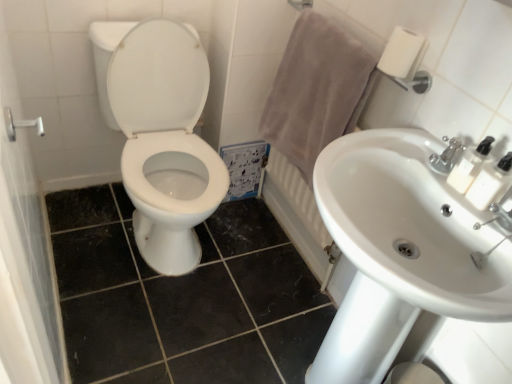
Find the location of a particular element. unoccupied area in front of white ceramic radiator at upper right is located at coordinates (265, 288).